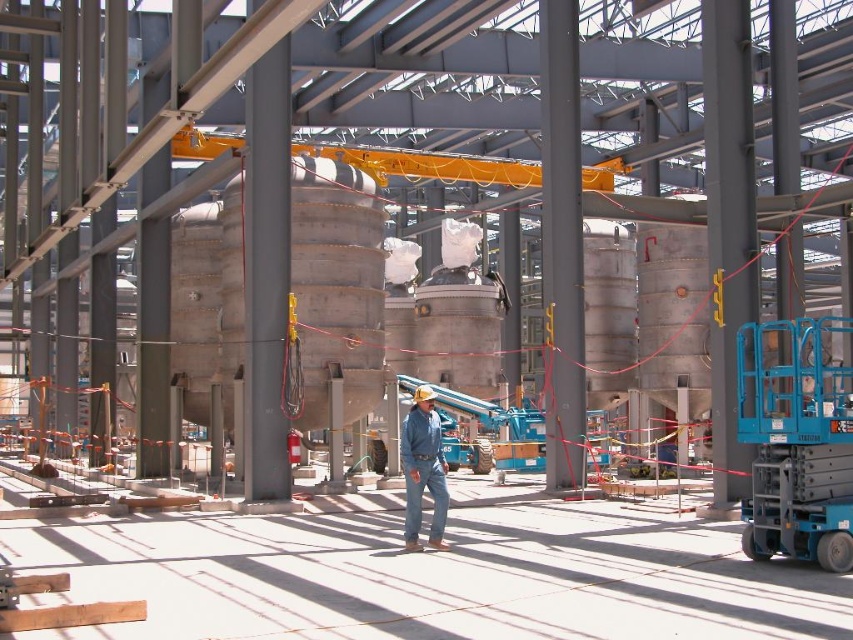
Question: Among these points, which one is nearest to the camera?

Choices:
 (A) (416, 518)
 (B) (419, 461)

Answer: (A)

Question: Which is nearer to the denim at center?

Choices:
 (A) blue denim jeans at center
 (B) blue metallic forklift at center

Answer: (A)

Question: Which point is closer to the camera?

Choices:
 (A) denim at center
 (B) blue metallic forklift at center

Answer: (A)

Question: Observing the image, what is the correct spatial positioning of blue denim jeans at center in reference to denim at center?

Choices:
 (A) above
 (B) below

Answer: (B)

Question: Is blue denim jeans at center to the left of denim at center from the viewer's perspective?

Choices:
 (A) no
 (B) yes

Answer: (A)

Question: Is blue denim jeans at center to the left of denim at center from the viewer's perspective?

Choices:
 (A) yes
 (B) no

Answer: (B)